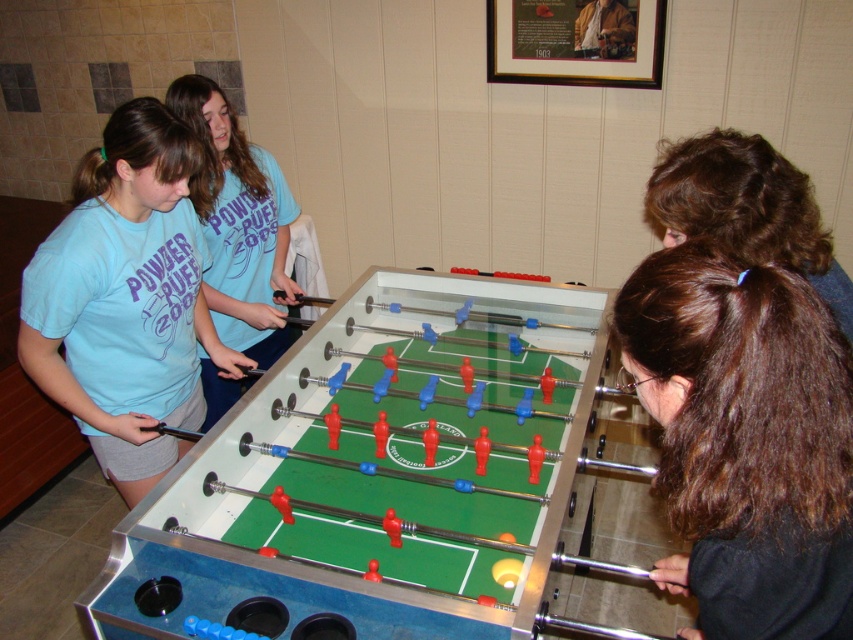
You are a photographer trying to capture a photo of the two individuals with brown hair at lower right and brown curly hair at center. Since you want to ensure both are fully visible in the frame, which one should you position closer to the camera to avoid being blocked by the other?

The brown curly hair at center should be positioned closer to the camera because the brown hair at lower right is taller than brown curly hair at center, so placing the shorter one closer would prevent the taller one from blocking it.

You are standing at the center of the room. Looking at the brown hair at lower right, where is it located in relation to the center of the room?

The brown hair at lower right is located at point 0.688 on the x axis and 0.876 on the y axis, which is to the right and lower than the center of the room.